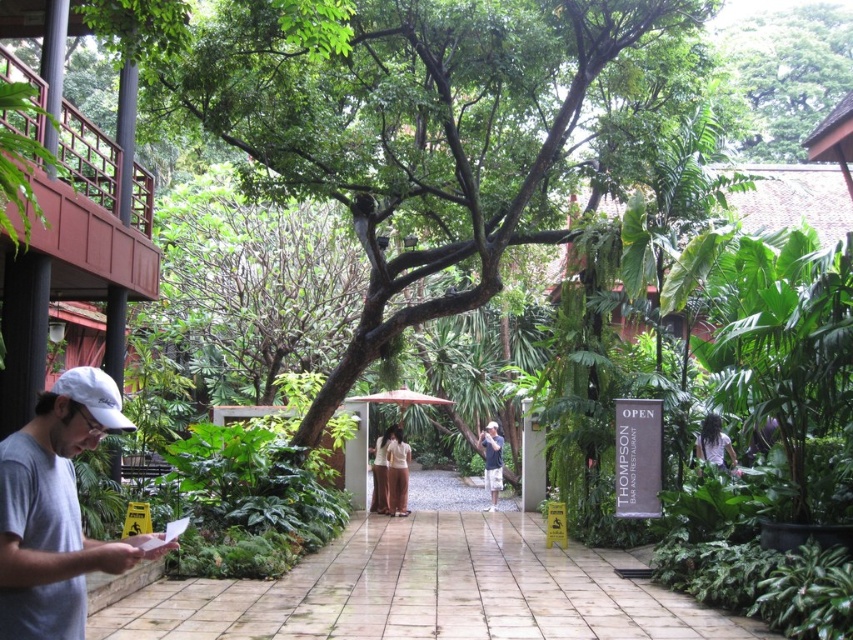
You are a photographer trying to capture both the light brown fabric pants at center and the light beige fabric dress at center in the same frame. Since you want to ensure both are fully visible, which clothing item should you focus on first to avoid cropping the taller one?

The light brown fabric pants at center is much taller than the light beige fabric dress at center, so you should focus on the light brown fabric pants at center first to ensure it is fully visible in the frame.

You are standing at the point marked by the coordinates point (422, 128) in the image. What object is located exactly at that position?

The point (422, 128) corresponds to the green leafy tree at center.